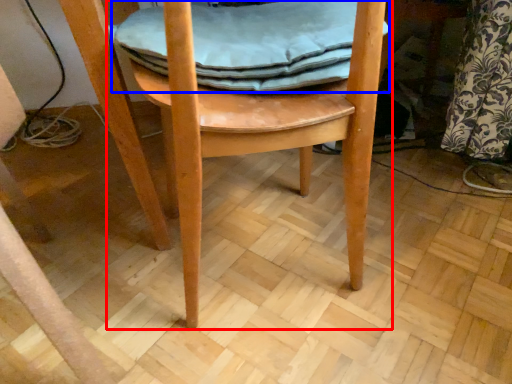
Question: Which point is further to the camera, chair (highlighted by a red box) or material (highlighted by a blue box)?

Choices:
 (A) chair
 (B) material

Answer: (B)